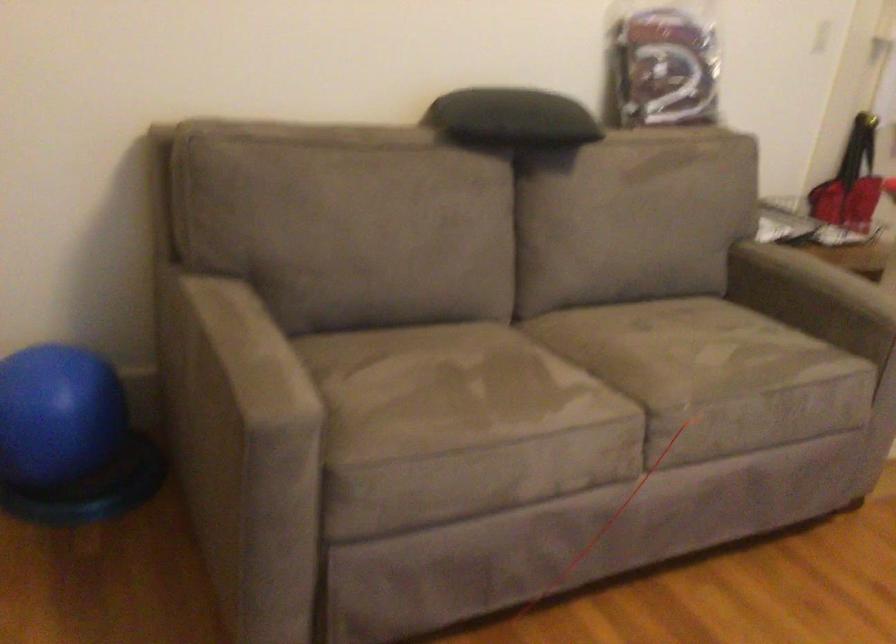
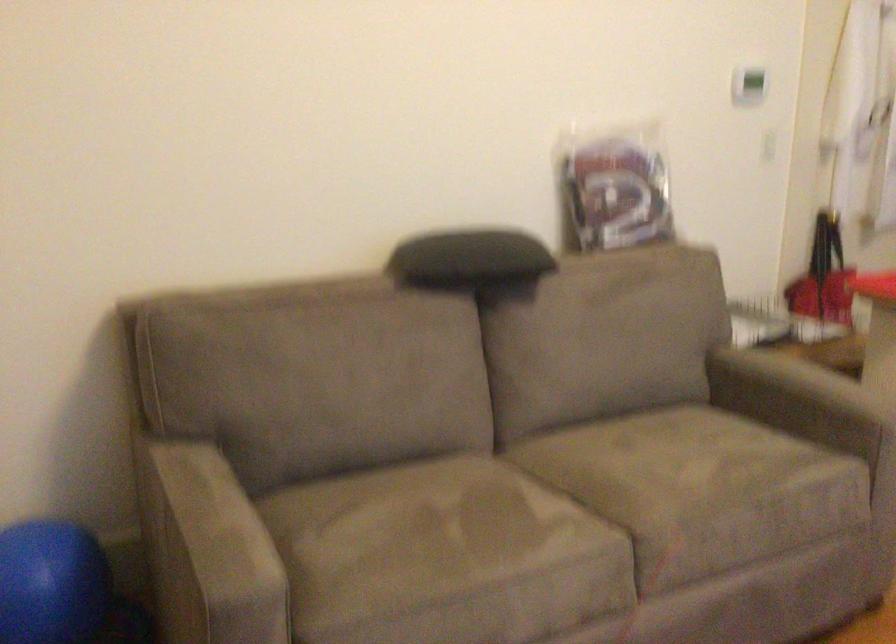
Find the pixel in the second image that matches (251,377) in the first image.

(209, 550)